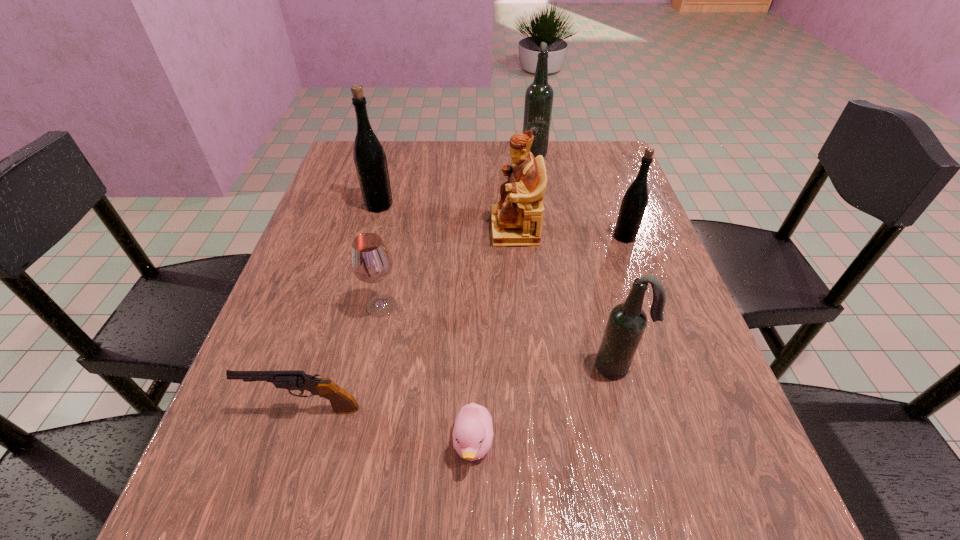
Locate an element on the screen. This screenshot has width=960, height=540. vacant area between the figurine and the left green beer bottle is located at coordinates (446, 217).

At what (x,y) coordinates should I click in order to perform the action: click on free area in between the leftmost beer bottle and the farther dark beer bottle. Please return your answer as a coordinate pair (x, y). Image resolution: width=960 pixels, height=540 pixels. Looking at the image, I should click on (456, 178).

Where is `free spot between the left dark beer bottle and the fourth nearest object`? The height and width of the screenshot is (540, 960). free spot between the left dark beer bottle and the fourth nearest object is located at coordinates (458, 228).

Find the location of `free space between the rightmost object and the farthest beer bottle`. free space between the rightmost object and the farthest beer bottle is located at coordinates (579, 193).

Find the location of a particular element. This screenshot has height=540, width=960. free spot between the leftmost beer bottle and the black gun is located at coordinates (342, 307).

Locate an element on the screen. This screenshot has width=960, height=540. vacant region between the left dark beer bottle and the fourth nearest object is located at coordinates (458, 228).

What are the coordinates of `vacant space that is in between the leftmost beer bottle and the bigger dark beer bottle` in the screenshot? It's located at (456, 178).

Locate an element on the screen. The height and width of the screenshot is (540, 960). unoccupied area between the farthest beer bottle and the smaller green beer bottle is located at coordinates (579, 193).

You are a GUI agent. You are given a task and a screenshot of the screen. Output one action in this format:
    pyautogui.click(x=<x>, y=<y>)
    Task: Click on the vacant area that lies between the fourth nearest object and the third beer bottle from right to left
    The width and height of the screenshot is (960, 540).
    Given the screenshot: What is the action you would take?
    pyautogui.click(x=458, y=228)

The height and width of the screenshot is (540, 960). I want to click on free space between the smaller green beer bottle and the figurine, so click(569, 233).